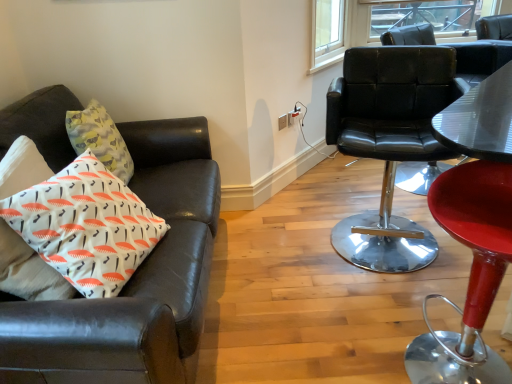
Question: From the image's perspective, is leather couch at left, arranged as the third chair when viewed from the right, above or below red leather bar stool at right, the first chair in the right-to-left sequence?

Choices:
 (A) above
 (B) below

Answer: (A)

Question: Would you say leather couch at left, acting as the 1th chair starting from the left, is inside or outside red leather bar stool at right, which appears as the 3th chair when viewed from the left?

Choices:
 (A) outside
 (B) inside

Answer: (A)

Question: Estimate the real-world distances between objects in this image. Which object is closer to the white plastic power outlet at upper center?

Choices:
 (A) black leather chair at right, which is the second chair in left-to-right order
 (B) white printed cushion at left
 (C) red leather bar stool at right, which appears as the 3th chair when viewed from the left
 (D) clear glass window at upper right
 (E) leather couch at left, arranged as the third chair when viewed from the right

Answer: (A)

Question: Considering the real-world distances, which object is farthest from the white printed cushion at left?

Choices:
 (A) clear glass window at upper right
 (B) leather couch at left, arranged as the third chair when viewed from the right
 (C) black leather chair at right, which is the second chair in left-to-right order
 (D) white plastic power outlet at upper center
 (E) red leather bar stool at right, the first chair in the right-to-left sequence

Answer: (A)